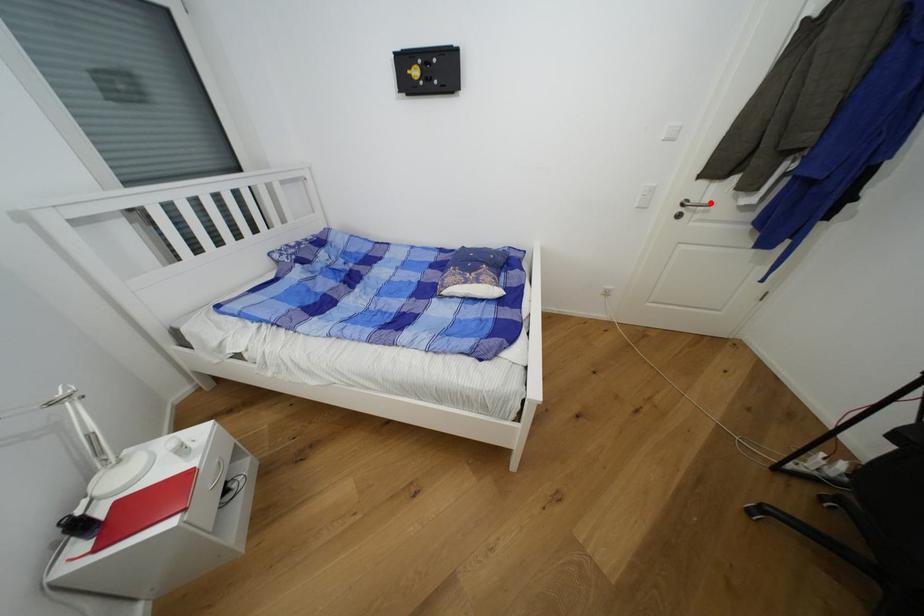
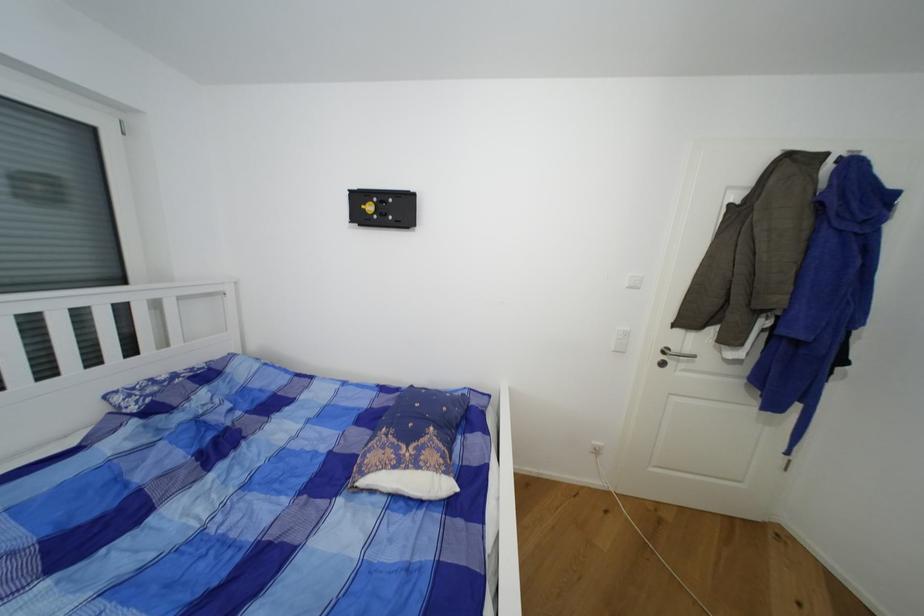
Where in the second image is the point corresponding to the highlighted location from the first image?

(691, 352)